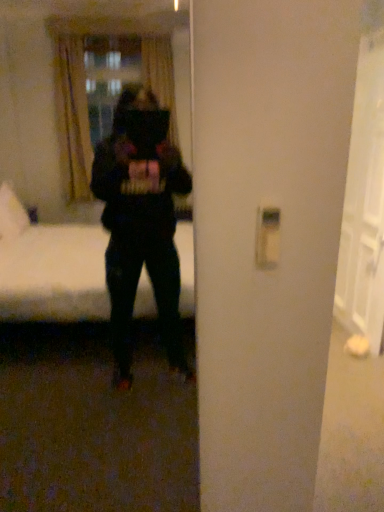
I want to click on white plastic light switch at right, so click(267, 237).

What is the approximate width of white glossy door at right?

white glossy door at right is 4.01 inches wide.

This screenshot has width=384, height=512. In order to click on white plastic light switch at right in this screenshot , I will do `click(267, 237)`.

What's the angular difference between white glossy door at right and black matte mirror at center's facing directions?

The facing directions of white glossy door at right and black matte mirror at center are 88.4 degrees apart.

Is white glossy door at right inside or outside of black matte mirror at center?

white glossy door at right is located beyond the bounds of black matte mirror at center.

Which object is further away from the camera taking this photo, white glossy door at right or black matte mirror at center?

white glossy door at right.

Considering the relative positions of white glossy door at right and black matte mirror at center in the image provided, is white glossy door at right to the right of black matte mirror at center from the viewer's perspective?

Indeed, white glossy door at right is positioned on the right side of black matte mirror at center.

Locate an element on the screen. The width and height of the screenshot is (384, 512). light switch above the white glossy door at right (from a real-world perspective) is located at coordinates (267, 237).

Is white glossy door at right positioned behind white plastic light switch at right?

Yes, white glossy door at right is behind white plastic light switch at right.

How different are the orientations of white glossy door at right and white plastic light switch at right in degrees?

88.4 degrees separate the facing orientations of white glossy door at right and white plastic light switch at right.

Is white glossy door at right oriented towards white plastic light switch at right?

No, white glossy door at right is not turned towards white plastic light switch at right.

Image resolution: width=384 pixels, height=512 pixels. Find the location of `glass door above the white plastic light switch at right (from the image's perspective)`. glass door above the white plastic light switch at right (from the image's perspective) is located at coordinates pyautogui.click(x=364, y=204).

From a real-world perspective, which object stands above the other?

From a 3D spatial view, white plastic light switch at right is above.

Looking at their sizes, would you say white plastic light switch at right is wider or thinner than white glossy door at right?

white plastic light switch at right is thinner than white glossy door at right.

Is white plastic light switch at right further to camera compared to white glossy door at right?

No, the depth of white plastic light switch at right is less than that of white glossy door at right.

From the image's perspective, is white plastic light switch at right located beneath black matte mirror at center?

No, from the image's perspective, white plastic light switch at right is not below black matte mirror at center.

What's the angular difference between white plastic light switch at right and black matte mirror at center's facing directions?

The angle between the facing direction of white plastic light switch at right and the facing direction of black matte mirror at center is 0.00458 degrees.

Is white plastic light switch at right wider or thinner than black matte mirror at center?

Considering their sizes, white plastic light switch at right looks slimmer than black matte mirror at center.

Looking at the image, does white plastic light switch at right seem bigger or smaller compared to black matte mirror at center?

Considering their sizes, white plastic light switch at right takes up less space than black matte mirror at center.

Is black matte mirror at center next to white plastic light switch at right and touching it?

There is a gap between black matte mirror at center and white plastic light switch at right.

Considering the relative sizes of black matte mirror at center and white plastic light switch at right in the image provided, is black matte mirror at center smaller than white plastic light switch at right?

Actually, black matte mirror at center might be larger than white plastic light switch at right.

Based on the photo, does black matte mirror at center turn towards white plastic light switch at right?

No, black matte mirror at center does not turn towards white plastic light switch at right.

Consider the image. Considering the relative positions of black matte mirror at center and white plastic light switch at right in the image provided, is black matte mirror at center to the left or to the right of white plastic light switch at right?

From the image, it's evident that black matte mirror at center is to the left of white plastic light switch at right.

Is black matte mirror at center not within white glossy door at right?

Yes.

From the image's perspective, which is below, black matte mirror at center or white glossy door at right?

From the image's view, black matte mirror at center is below.

Based on their positions, is black matte mirror at center located to the left or right of white glossy door at right?

In the image, black matte mirror at center appears on the left side of white glossy door at right.

Between point (20, 76) and point (380, 322), which one is positioned behind?

Point (20, 76)

Find the location of `glass door on the right of black matte mirror at center`. glass door on the right of black matte mirror at center is located at coordinates (364, 204).

Where is `light switch on the left of the white glossy door at right`? This screenshot has height=512, width=384. light switch on the left of the white glossy door at right is located at coordinates (267, 237).

Considering their positions, is white plastic light switch at right positioned closer to black matte mirror at center than white glossy door at right?

white glossy door at right is closer to black matte mirror at center.

When comparing their distances from black matte mirror at center, does white glossy door at right or white plastic light switch at right seem closer?

white glossy door at right is closer to black matte mirror at center.

Based on their spatial positions, is white plastic light switch at right or black matte mirror at center further from white glossy door at right?

black matte mirror at center.

Based on their spatial positions, is black matte mirror at center or white glossy door at right closer to white plastic light switch at right?

white glossy door at right is positioned closer to the anchor white plastic light switch at right.

When comparing their distances from white plastic light switch at right, does white glossy door at right or black matte mirror at center seem closer?

The object closer to white plastic light switch at right is white glossy door at right.

From the image, which object appears to be nearer to white glossy door at right, black matte mirror at center or white plastic light switch at right?

white plastic light switch at right.

Locate an element on the screen. Image resolution: width=384 pixels, height=512 pixels. light switch positioned between black matte mirror at center and white glossy door at right from near to far is located at coordinates (267, 237).